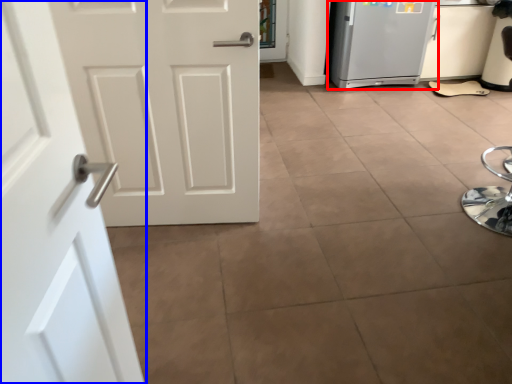
Question: Which object is further to the camera taking this photo, refrigerator (highlighted by a red box) or door (highlighted by a blue box)?

Choices:
 (A) refrigerator
 (B) door

Answer: (A)